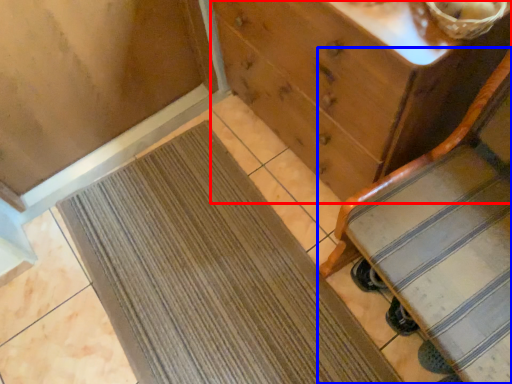
Question: Which object is further to the camera taking this photo, chest of drawers (highlighted by a red box) or furniture (highlighted by a blue box)?

Choices:
 (A) chest of drawers
 (B) furniture

Answer: (A)